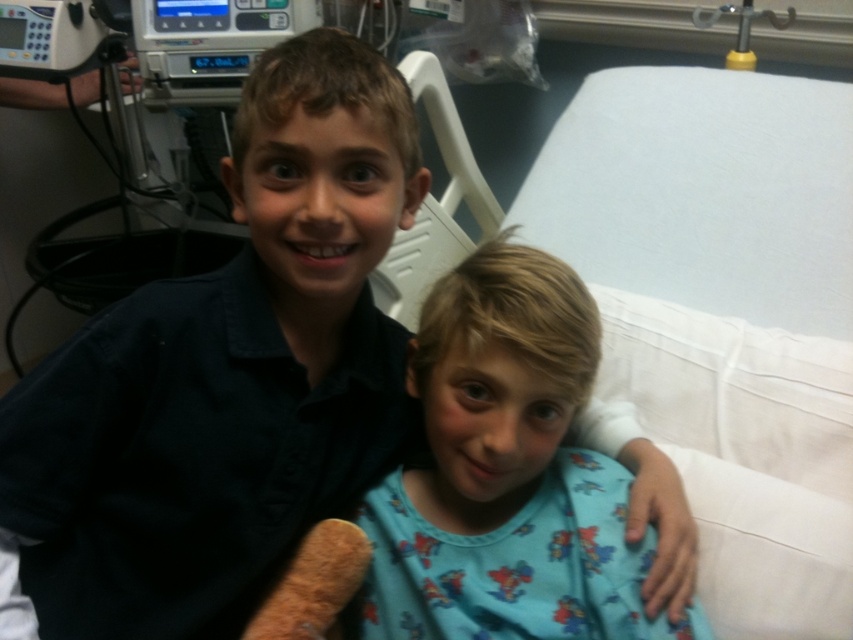
You are a nurse checking the hospital room. You need to place a new medical kit on the bed that can fit both the white fabric bed at center and the blue cotton shirt at center. Can you confirm if there is enough space?

The white fabric bed at center is larger in size than the blue cotton shirt at center, so there should be enough space to place the medical kit on the bed.